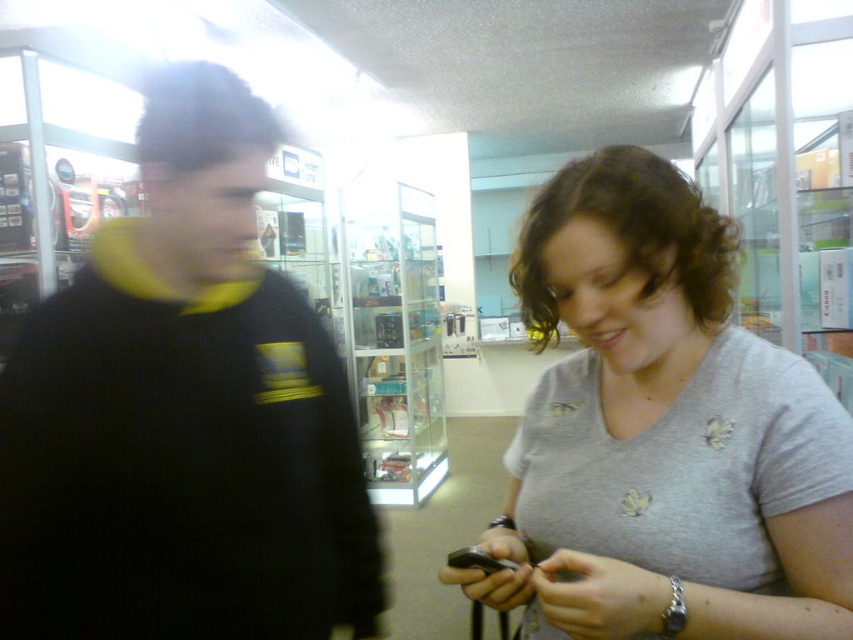
Question: Does black/yellow sweater at left have a larger size compared to gray cotton shirt at center?

Choices:
 (A) yes
 (B) no

Answer: (A)

Question: Is black/yellow sweater at left positioned before gray cotton shirt at center?

Choices:
 (A) no
 (B) yes

Answer: (A)

Question: Among these objects, which one is nearest to the camera?

Choices:
 (A) black/yellow sweater at left
 (B) gray cotton shirt at center

Answer: (B)

Question: Is black/yellow sweater at left thinner than gray cotton shirt at center?

Choices:
 (A) yes
 (B) no

Answer: (B)

Question: Which of the following is the farthest from the observer?

Choices:
 (A) black/yellow sweater at left
 (B) gray cotton shirt at center

Answer: (A)